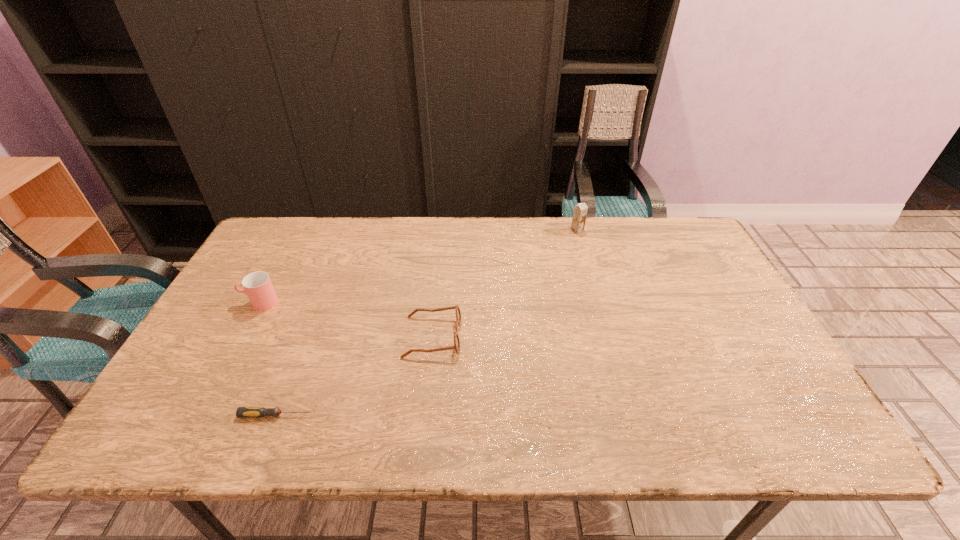
The image size is (960, 540). What are the coordinates of `free space that is in between the third tallest object and the chocolate milk` in the screenshot? It's located at (505, 283).

At what (x,y) coordinates should I click in order to perform the action: click on free space between the third nearest object and the nearest object. Please return your answer as a coordinate pair (x, y). The image size is (960, 540). Looking at the image, I should click on (269, 359).

Identify the location of free point between the farthest object and the leftmost object. (419, 266).

This screenshot has width=960, height=540. I want to click on free space between the shortest object and the second object from right to left, so click(355, 376).

I want to click on unoccupied position between the third object from left to right and the leftmost object, so click(x=347, y=320).

Where is `free space between the second shortest object and the third object from right to left`? This screenshot has height=540, width=960. free space between the second shortest object and the third object from right to left is located at coordinates (355, 376).

Locate an element on the screen. Image resolution: width=960 pixels, height=540 pixels. free point between the third nearest object and the screwdriver is located at coordinates (269, 359).

I want to click on unoccupied area between the third shortest object and the tallest object, so click(419, 266).

Identify the location of free space between the nearest object and the third shortest object. (269, 359).

Locate an element on the screen. This screenshot has width=960, height=540. free space between the second shortest object and the cup is located at coordinates (347, 320).